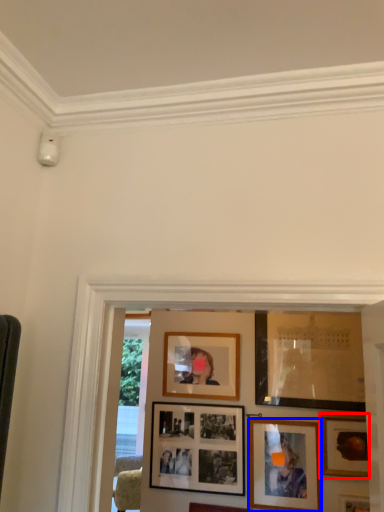
Question: Which of the following is the closest to the observer, picture frame (highlighted by a red box) or picture frame (highlighted by a blue box)?

Choices:
 (A) picture frame
 (B) picture frame

Answer: (A)